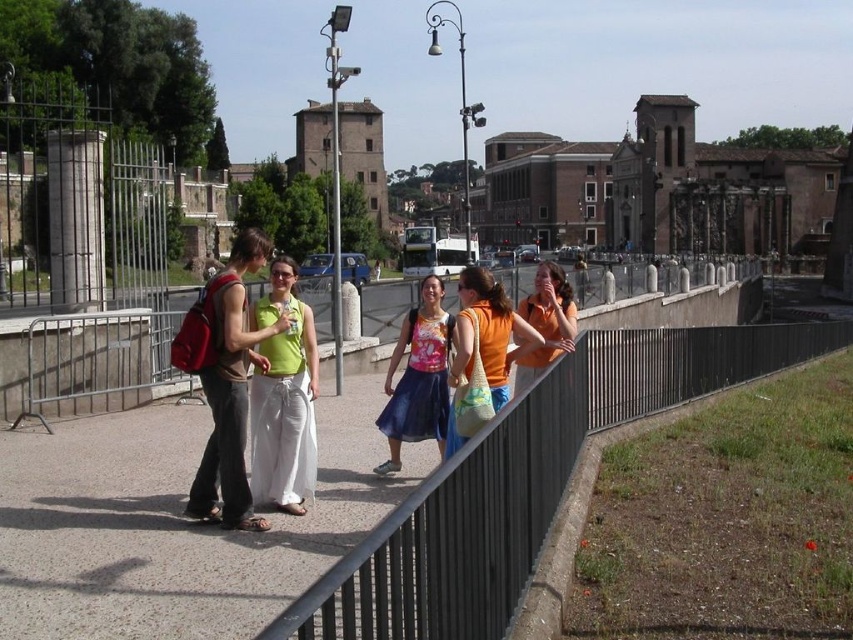
You are standing at point (494, 342) and want to move to point (148, 387). Given that you can only move forward in a straight line, will you be able to reach the second point without changing direction?

Point (148, 387) is behind point (494, 342), so you cannot reach it by moving forward in a straight line from your current position at point (494, 342) without changing direction.

You are a photographer trying to capture a photo of the matte pink blouse at center without the black metal fence at center blocking the view. Is this possible based on their positions?

The black metal fence at center is taller than the matte pink blouse at center, so the fence will likely block the view of the blouse unless you adjust your angle or position to get under or around the fence.

You are standing at the center of the scene and want to find the metallic gray fence at center. Based on the coordinates provided, in which direction should you look to locate it?

The metallic gray fence at center is located at coordinates point (x=82, y=368). Since you are at the center, you should look slightly to the right and downward to find it.